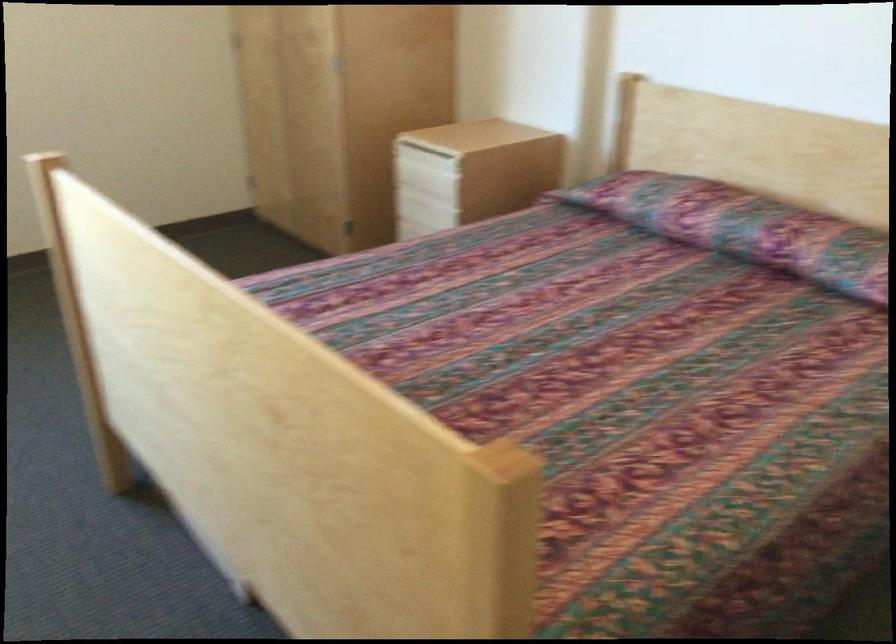
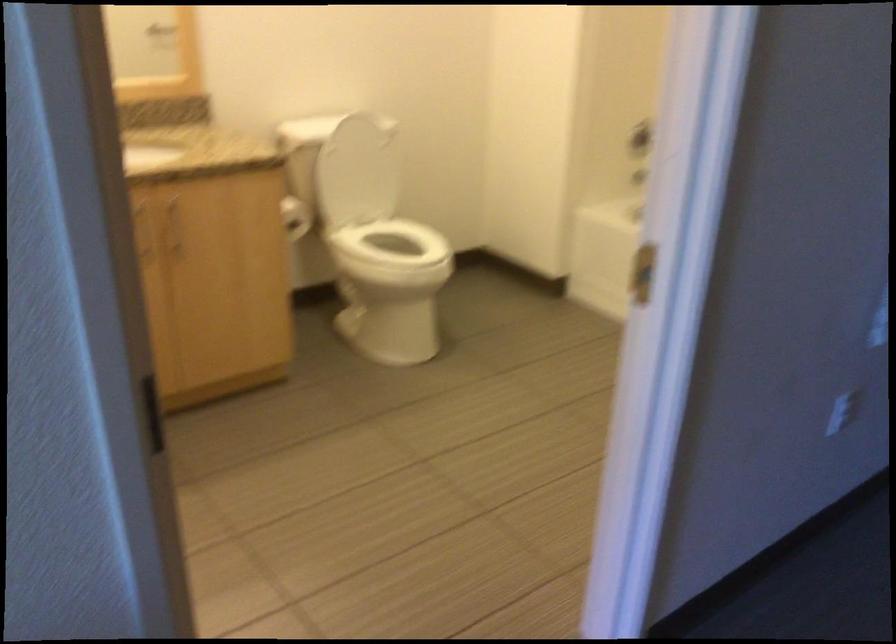
The images are taken continuously from a first-person perspective. In which direction is your viewpoint rotating?

The camera rotated toward right-down.